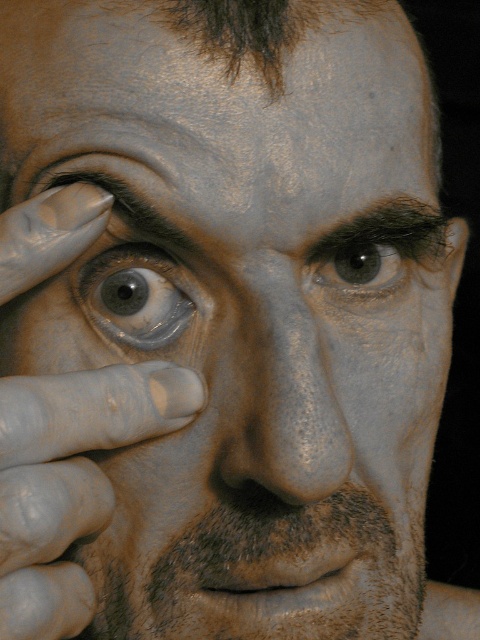
Is smooth skin at upper center positioned behind dark brown hair at upper center?

No.

Where is `smooth skin at upper center`? smooth skin at upper center is located at coordinates (197, 49).

This screenshot has height=640, width=480. Identify the location of smooth skin at upper center. (197, 49).

Is matte gray eye at center to the right of dark brown hair at upper center from the viewer's perspective?

Incorrect, matte gray eye at center is not on the right side of dark brown hair at upper center.

Is matte gray eye at center positioned before dark brown hair at upper center?

Yes, matte gray eye at center is closer to the viewer.

Is point (87, 298) closer to camera compared to point (342, 237)?

Yes.

At what (x,y) coordinates should I click in order to perform the action: click on matte gray eye at center. Please return your answer as a coordinate pair (x, y). Looking at the image, I should click on (133, 296).

The image size is (480, 640). Describe the element at coordinates (385, 234) in the screenshot. I see `dark brown hair at upper center` at that location.

Locate an element on the screen. Image resolution: width=480 pixels, height=640 pixels. dark brown hair at upper center is located at coordinates (385, 234).

Identify the location of dark brown hair at upper center. The width and height of the screenshot is (480, 640). (385, 234).